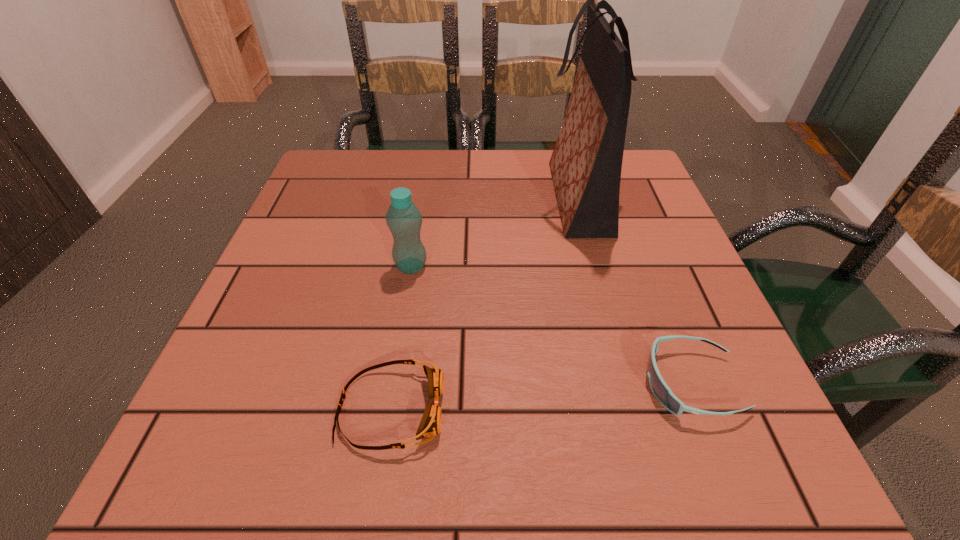
Image resolution: width=960 pixels, height=540 pixels. What are the coordinates of `vacant region located 0.350m on the front-facing side of the right goggles` in the screenshot? It's located at (413, 383).

Locate an element on the screen. free spot located 0.320m on the front-facing side of the right goggles is located at coordinates (433, 383).

Where is `vacant region located on the front-facing side of the right goggles`? The width and height of the screenshot is (960, 540). vacant region located on the front-facing side of the right goggles is located at coordinates click(598, 383).

This screenshot has width=960, height=540. In order to click on free space located 0.110m with the lenses facing forward on the left goggles in this screenshot , I will do `click(519, 409)`.

You are a GUI agent. You are given a task and a screenshot of the screen. Output one action in this format:
    pyautogui.click(x=<x>, y=<y>)
    Task: Click on the object positioned at the far edge
    The image size is (960, 540).
    Given the screenshot: What is the action you would take?
    pyautogui.click(x=586, y=163)

At what (x,y) coordinates should I click in order to perform the action: click on shopping bag that is at the right edge. Please return your answer as a coordinate pair (x, y). The height and width of the screenshot is (540, 960). Looking at the image, I should click on (586, 163).

Image resolution: width=960 pixels, height=540 pixels. I want to click on goggles at the right edge, so click(x=660, y=389).

Locate an element on the screen. The image size is (960, 540). object that is at the far right corner is located at coordinates (586, 163).

I want to click on object that is at the near right corner, so [x=660, y=389].

The height and width of the screenshot is (540, 960). I want to click on vacant space at the far edge of the desktop, so click(504, 190).